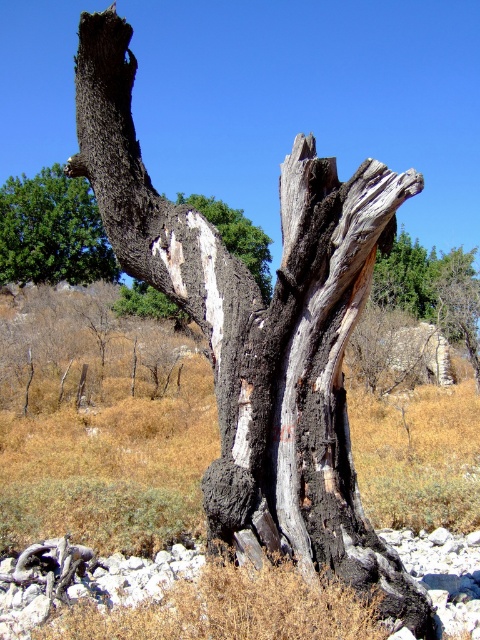
You are an environmental scientist assessing the health of the forest. You notice the green leafy tree at upper left and the white textured bark at center. Which of these two objects is positioned higher in the image?

The green leafy tree at upper left is located above the white textured bark at center, so it is positioned higher in the image.

You are an environmental scientist assessing the health of the forest. You notice the green leafy tree at upper left and the white textured bark at center. Which of these two objects is shorter in height?

The green leafy tree at upper left has a lesser height compared to the white textured bark at center, so the green leafy tree at upper left is shorter.

You are an environmental scientist assessing the health of the forest. You notice the green leafy tree at upper left and the white textured bark at center. Which object is closer to you as you stand in front of the scene?

The green leafy tree at upper left is closer to you because the white textured bark at center is behind it, indicating the green leafy tree is in front.